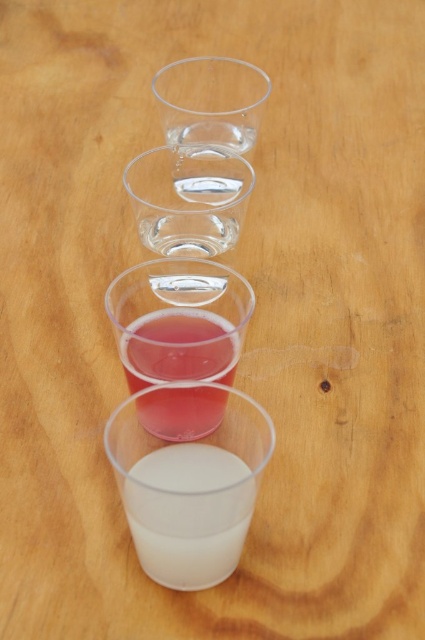
You are organizing a small party and need to arrange drinks. You have a translucent plastic cup at center and a transparent plastic shot glass at center. According to the image, which one should you place higher up to maintain the gradient effect seen in the cup arrangement?

The transparent plastic shot glass at center should be placed higher up because the translucent plastic cup at center is positioned below it in the gradient sequence.

You are holding a small toy that is 3 inches wide. You want to place it in the white opaque cup at center. Can the toy fit inside the cup?

The white opaque cup at center and viewer are 8.51 inches apart. The distance between the cup and the viewer does not indicate the cup size. Therefore, it is unclear if the toy will fit inside the cup.

You are holding a camera and want to take a photo of the white opaque cup at center. The camera requires a minimum distance of 9 inches to focus properly. Will you be able to take a clear photo from your current position?

The white opaque cup at center and camera are 8.51 inches apart from each other. Since the required minimum distance is 9 inches, the camera cannot focus properly at this distance. Move closer to achieve the necessary distance for clear focus.